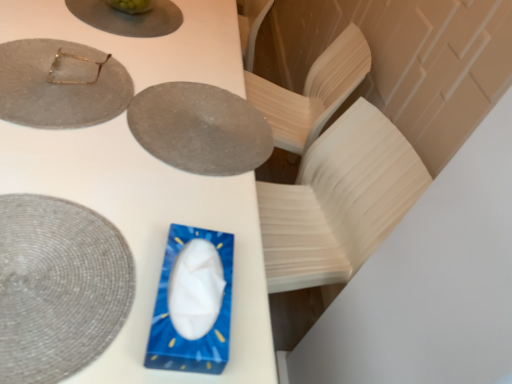
You are a GUI agent. You are given a task and a screenshot of the screen. Output one action in this format:
    pyautogui.click(x=<x>, y=<y>)
    Task: Click on the unoccupied area behind matte gray plate at upper center, placed as the third plate when sorted from top to bottom
    The width and height of the screenshot is (512, 384).
    Given the screenshot: What is the action you would take?
    pyautogui.click(x=198, y=56)